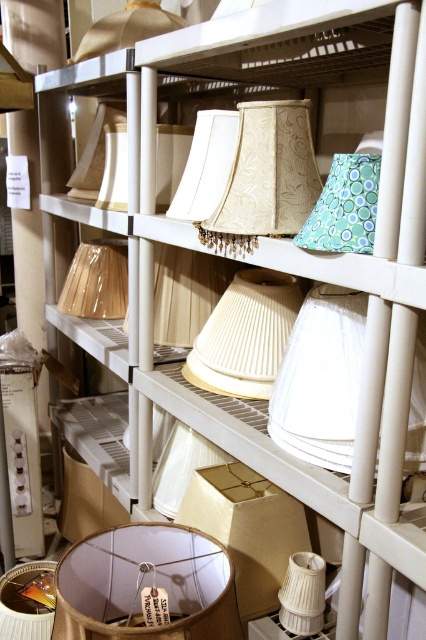
Is white fabric lampshade at center positioned in front of matte beige lampshade at center?

Yes, white fabric lampshade at center is closer to the viewer.

Who is shorter, white fabric lampshade at center or matte beige lampshade at center?

white fabric lampshade at center

This screenshot has height=640, width=426. What do you see at coordinates (321, 378) in the screenshot?
I see `white fabric lampshade at center` at bounding box center [321, 378].

You are a GUI agent. You are given a task and a screenshot of the screen. Output one action in this format:
    pyautogui.click(x=<x>, y=<y>)
    Task: Click on the white fabric lampshade at center
    
    Given the screenshot: What is the action you would take?
    pyautogui.click(x=321, y=378)

Does beige fabric lampshade at center have a greater width compared to matte cream fabric lampshade at center?

Yes, beige fabric lampshade at center is wider than matte cream fabric lampshade at center.

Which is in front, point (244, 225) or point (216, 154)?

Point (244, 225) is in front.

Identify the location of beige fabric lampshade at center. (267, 177).

Does beige fabric lampshade at center have a lesser height compared to beige pleated lampshade at center?

Correct, beige fabric lampshade at center is not as tall as beige pleated lampshade at center.

Which is more to the left, beige fabric lampshade at center or beige pleated lampshade at center?

beige pleated lampshade at center is more to the left.

Between point (252, 168) and point (278, 356), which one is positioned in front?

Point (252, 168) is more forward.

Locate an element on the screen. Image resolution: width=426 pixels, height=640 pixels. beige fabric lampshade at center is located at coordinates (267, 177).